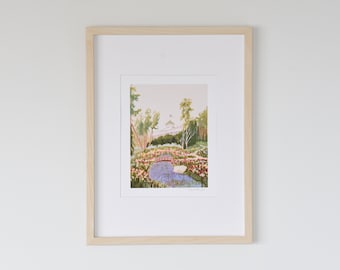
At what (x,y) coordinates should I click in order to perform the action: click on top left corner of painting. Please return your answer as a coordinate pair (x, y). Looking at the image, I should click on (130, 87).